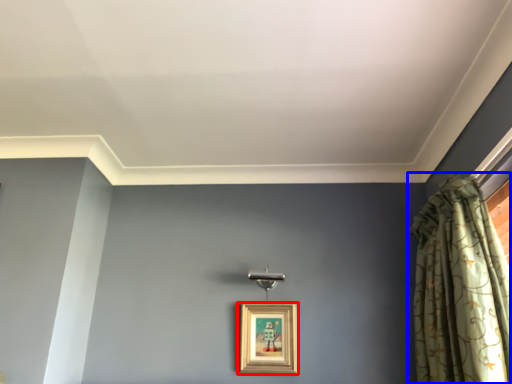
Question: Which point is closer to the camera, picture frame (highlighted by a red box) or curtain (highlighted by a blue box)?

Choices:
 (A) picture frame
 (B) curtain

Answer: (B)